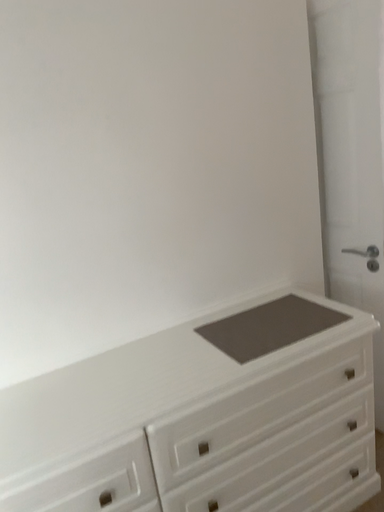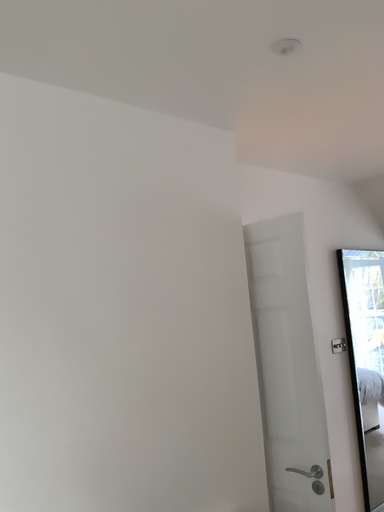
Question: How did the camera likely rotate when shooting the video?

Choices:
 (A) rotated left
 (B) rotated right

Answer: (B)